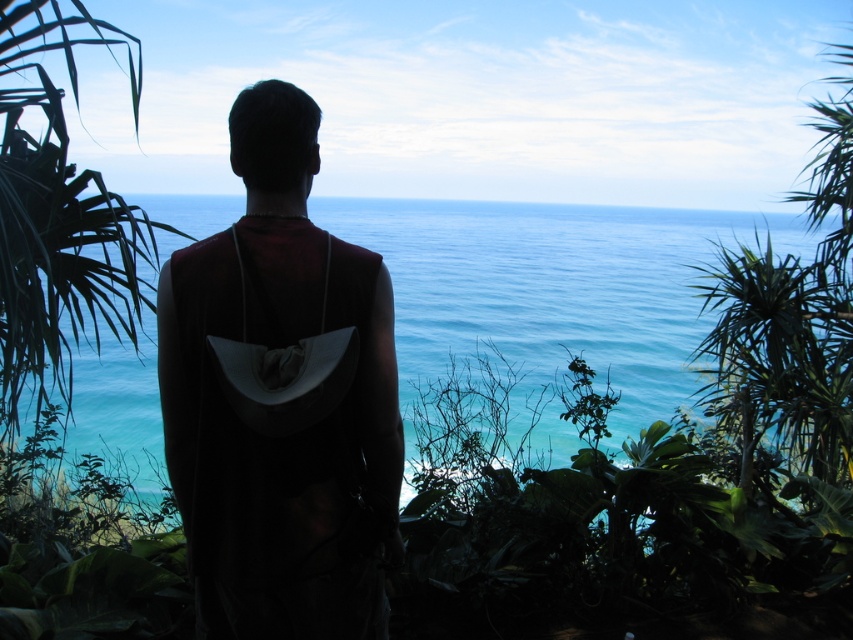
Image resolution: width=853 pixels, height=640 pixels. I want to click on dark fabric backpack at center, so click(x=281, y=400).

Based on the photo, can you confirm if dark fabric backpack at center is positioned above blue water at center?

Actually, dark fabric backpack at center is below blue water at center.

Does point (231, 371) come closer to viewer compared to point (575, 337)?

Yes.

Where is `dark fabric backpack at center`? dark fabric backpack at center is located at coordinates (281, 400).